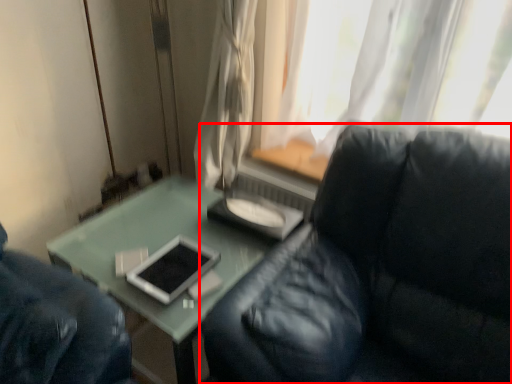
Question: From the image's perspective, what is the correct spatial relationship of studio couch (annotated by the red box) in relation to curtain?

Choices:
 (A) below
 (B) above

Answer: (A)